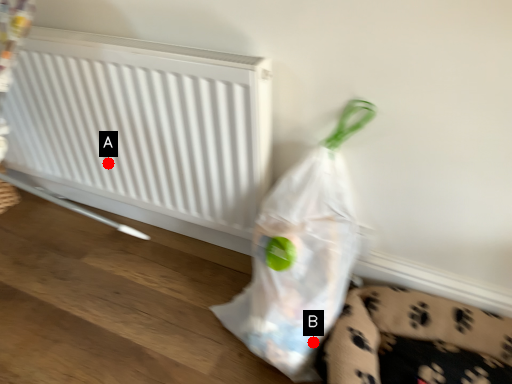
Question: Two points are circled on the image, labeled by A and B beside each circle. Which point is farther to the camera?

Choices:
 (A) A is further
 (B) B is further

Answer: (A)